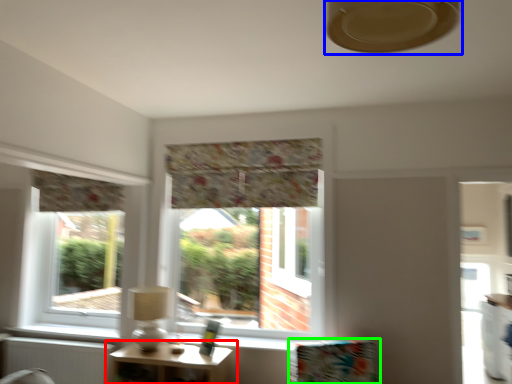
Question: Which object is positioned farthest from table (highlighted by a red box)? Select from fan (highlighted by a blue box) and furniture (highlighted by a green box).

Choices:
 (A) fan
 (B) furniture

Answer: (A)